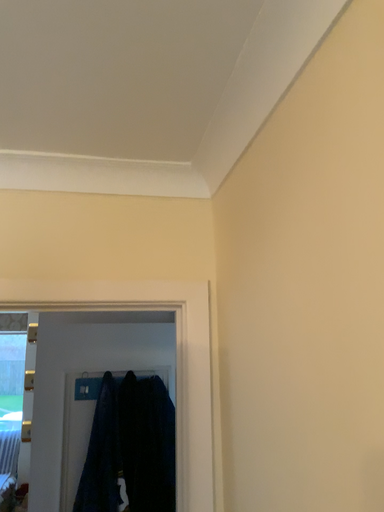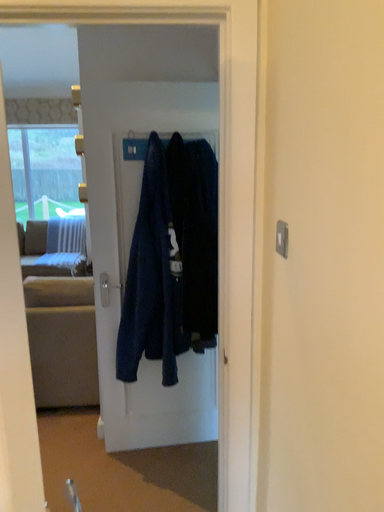
Question: Which way did the camera rotate in the video?

Choices:
 (A) rotated right
 (B) rotated left

Answer: (B)